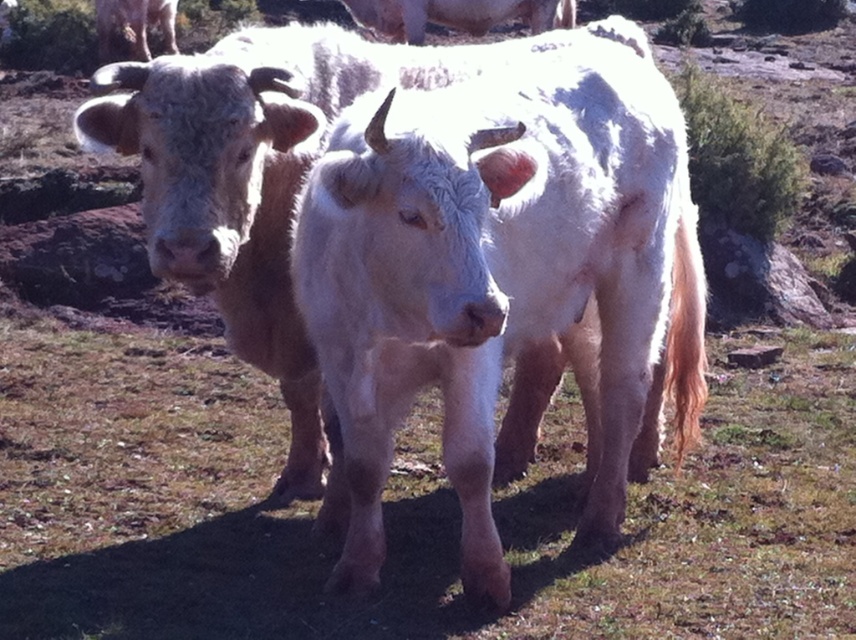
You are a farmer checking the field. You see the green grass at center and the white woolly cow at center. Which one is wider?

The green grass at center might be wider than white woolly cow at center.

You are a farmer who needs to locate the green grass at center in your field. Based on the coordinates provided, can you determine its exact position?

The green grass at center is located at coordinates point (401,509).

You are a farmer checking your field. You see the green grass at center and the white woolly cow at center. Which one is closer to you?

The green grass at center is closer to you because the white woolly cow at center is behind it.